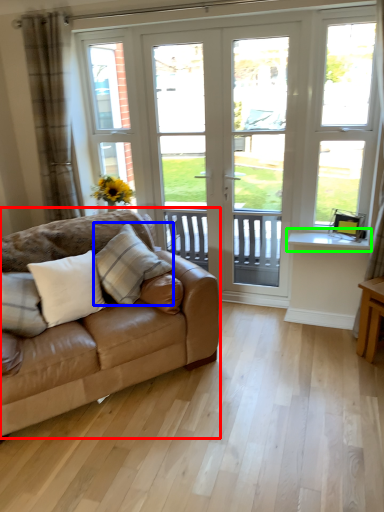
Question: Estimate the real-world distances between objects in this image. Which object is farther from studio couch (highlighted by a red box), pillow (highlighted by a blue box) or window sill (highlighted by a green box)?

Choices:
 (A) pillow
 (B) window sill

Answer: (B)